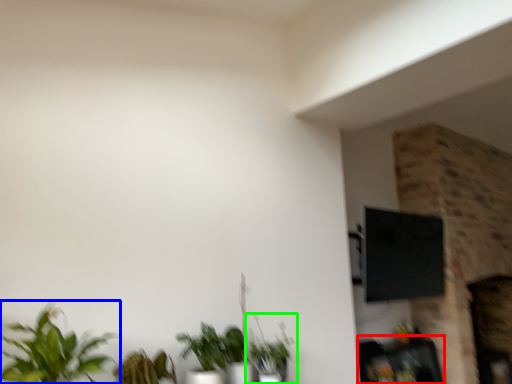
Question: Which object is positioned closest to furniture (highlighted by a red box)? Select from houseplant (highlighted by a blue box) and houseplant (highlighted by a green box).

Choices:
 (A) houseplant
 (B) houseplant

Answer: (B)